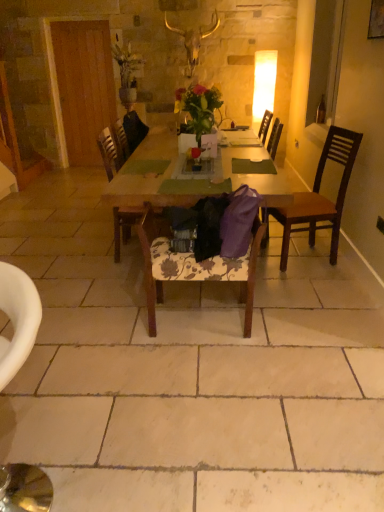
At what (x,y) coordinates should I click in order to perform the action: click on vacant space in brown wooden chair at right, which is the first chair in right-to-left order (from a real-world perspective). Please return your answer as a coordinate pair (x, y). Looking at the image, I should click on (302, 257).